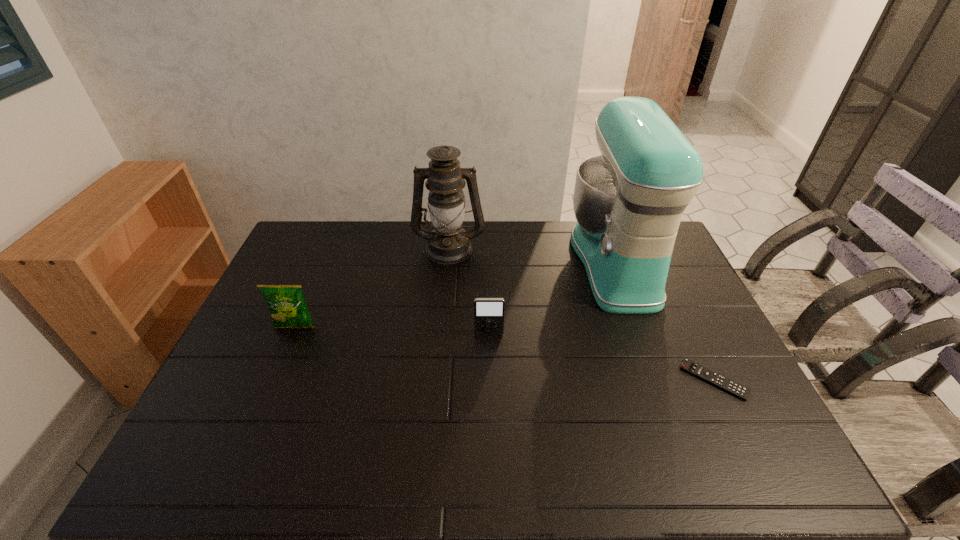
What are the coordinates of `blank area located 0.080m on the back of the second tallest object` in the screenshot? It's located at (451, 221).

In order to click on free space located 0.170m on the front-facing side of the leftmost object in this screenshot , I will do `click(273, 381)`.

Identify the location of vacant space located 0.070m on the front-facing side of the iPod. (490, 355).

You are a GUI agent. You are given a task and a screenshot of the screen. Output one action in this format:
    pyautogui.click(x=<x>, y=<y>)
    Task: Click on the vacant area situated 0.370m on the back of the remote control
    The width and height of the screenshot is (960, 540).
    Given the screenshot: What is the action you would take?
    (x=662, y=273)

Find the location of `mixer situated at the far edge`. mixer situated at the far edge is located at coordinates (628, 201).

The height and width of the screenshot is (540, 960). Identify the location of oil lamp at the far edge. (448, 243).

Image resolution: width=960 pixels, height=540 pixels. Identify the location of object that is at the left edge. (288, 308).

Where is `mixer present at the right edge`? mixer present at the right edge is located at coordinates (628, 201).

Locate an element on the screen. remote control present at the right edge is located at coordinates (689, 366).

Where is `object that is positioned at the far right corner`? object that is positioned at the far right corner is located at coordinates (628, 201).